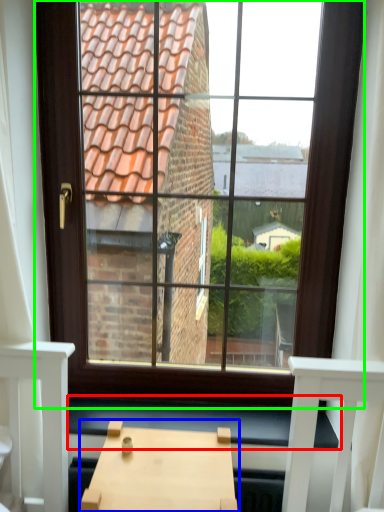
Question: Estimate the real-world distances between objects in this image. Which object is farther from window sill (highlighted by a red box), table (highlighted by a blue box) or window (highlighted by a green box)?

Choices:
 (A) table
 (B) window

Answer: (A)